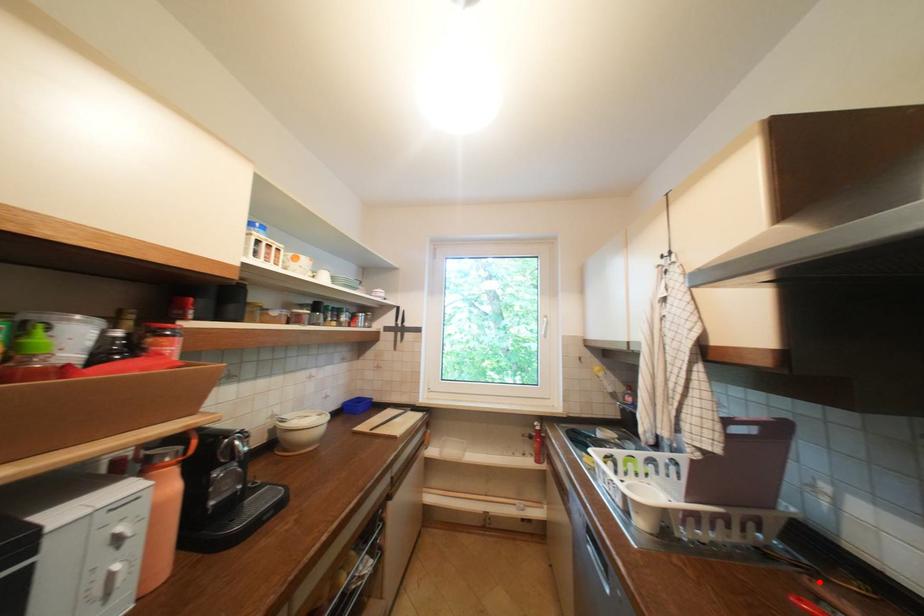
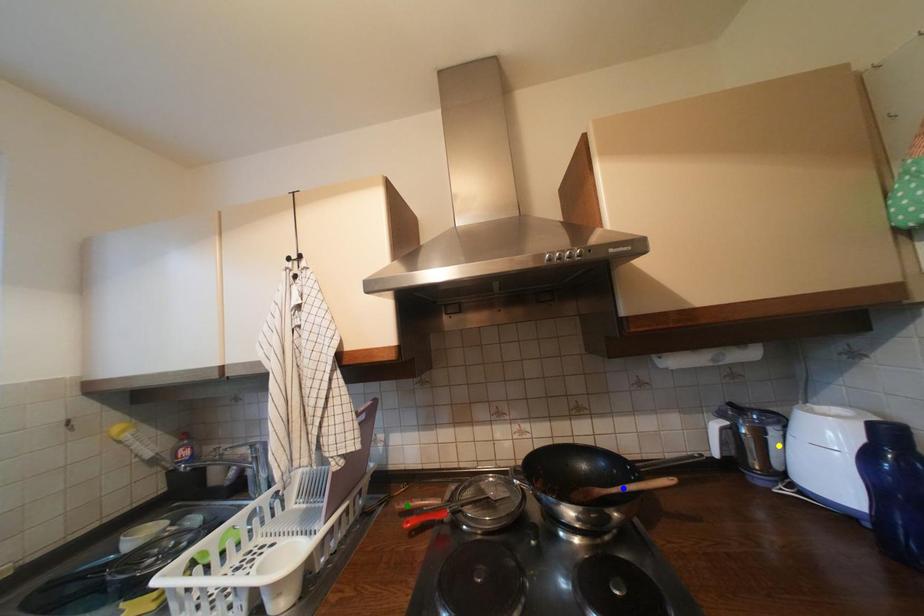
Question: I am providing you with two images of the same scene from different viewpoints. A red point is marked on the first image. You are given multiple points on the second image. Can you choose the point in image 2 that corresponds to the point in image 1?

Choices:
 (A) green point
 (B) blue point
 (C) yellow point

Answer: (A)